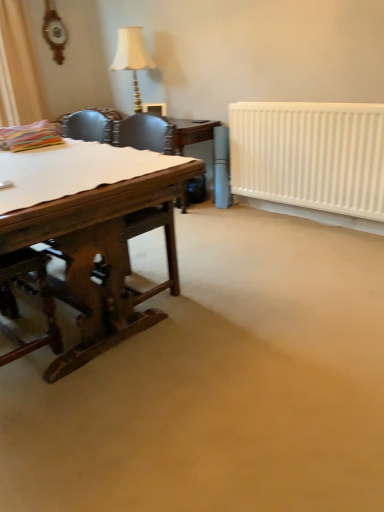
Where is `blank space above white matte radiator at right (from a real-world perspective)`? Image resolution: width=384 pixels, height=512 pixels. blank space above white matte radiator at right (from a real-world perspective) is located at coordinates (317, 93).